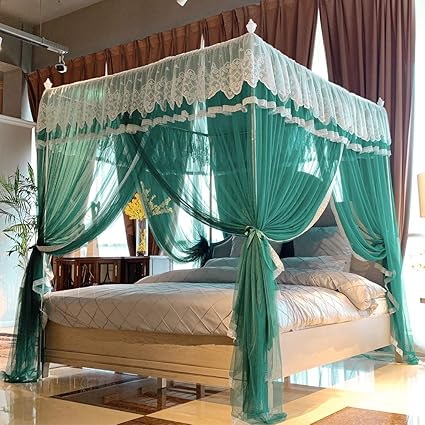
At what (x,y) coordinates should I click in order to perform the action: click on plant. Please return your answer as a coordinate pair (x, y). Image resolution: width=425 pixels, height=425 pixels. Looking at the image, I should click on (22, 231).